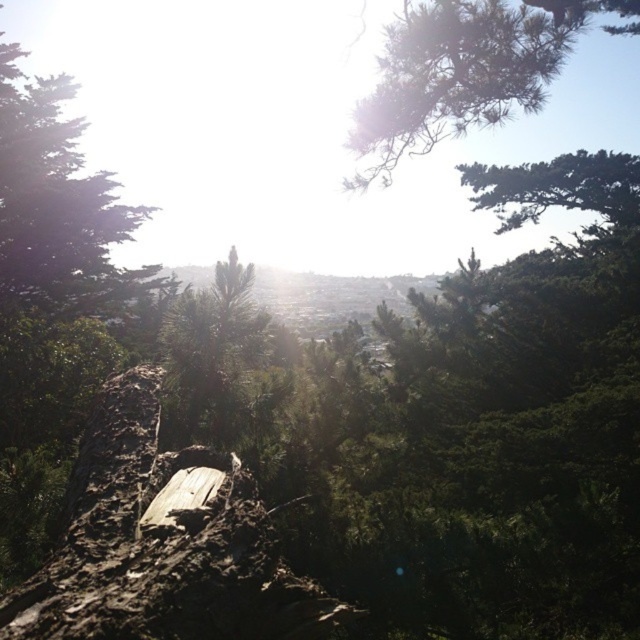
Does weathered wood log at center lie behind green textured pine branch at upper center?

No, it is in front of green textured pine branch at upper center.

Is point (154, 561) positioned before point (536, 8)?

Yes, it is.

Who is more forward, (145, 378) or (502, 115)?

Point (145, 378) is in front.

Image resolution: width=640 pixels, height=640 pixels. I want to click on weathered wood log at center, so click(163, 544).

Is the position of green matte tree at upper left less distant than that of green textured pine branch at upper center?

No, it is behind green textured pine branch at upper center.

Is point (131, 333) behind point (484, 99)?

Yes, it is behind point (484, 99).

You are a GUI agent. You are given a task and a screenshot of the screen. Output one action in this format:
    pyautogui.click(x=<x>, y=<y>)
    Task: Click on the green matte tree at upper left
    
    Given the screenshot: What is the action you would take?
    pyautogui.click(x=64, y=218)

Can you confirm if weathered wood log at center is wider than green matte tree at upper left?

In fact, weathered wood log at center might be narrower than green matte tree at upper left.

Is weathered wood log at center positioned before green matte tree at upper left?

Yes, weathered wood log at center is in front of green matte tree at upper left.

The image size is (640, 640). I want to click on weathered wood log at center, so click(163, 544).

I want to click on weathered wood log at center, so click(163, 544).